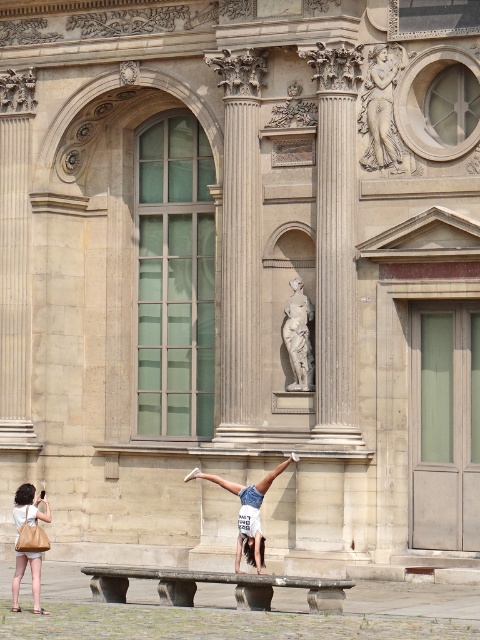
You are a visitor at the museum and want to pick up your matte beige handbag at lower left. Where should you look relative to the denim shorts at center?

The denim shorts at center is located above the matte beige handbag at lower left, so you should look below the denim shorts at center to find your matte beige handbag at lower left.

You are a tour guide explaining the scene to visitors. Point out the location of the matte beige handbag at lower left relative to the denim shorts at center.

The matte beige handbag at lower left is located behind the denim shorts at center.

You are standing in front of the classical building and want to take a photo. There are two points marked in the scene, point 1 at coordinates point (x=202, y=476) and point 2 at coordinates point (x=294, y=326). Which point is closer to you?

Point (x=202, y=476) is closer to the camera than point (x=294, y=326).